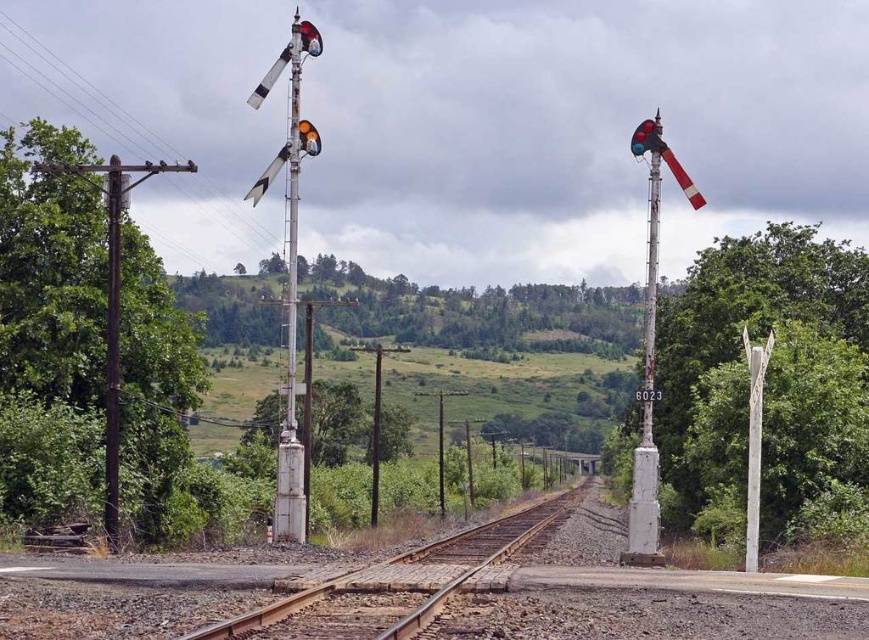
Question: Which object appears farthest from the camera in this image?

Choices:
 (A) metallic orange traffic light at center
 (B) white concrete pole at center

Answer: (A)

Question: Among these points, which one is farthest from the camera?

Choices:
 (A) (308, 124)
 (B) (463, 541)

Answer: (B)

Question: Can you confirm if brown gravel train track at center is positioned to the left of white painted metal pole at left?

Choices:
 (A) no
 (B) yes

Answer: (A)

Question: Is brown gravel train track at center wider than metallic signal light at upper left?

Choices:
 (A) yes
 (B) no

Answer: (A)

Question: Which object is the closest to the metallic orange traffic light at center?

Choices:
 (A) white painted metal pole at left
 (B) white concrete pole at center

Answer: (A)

Question: Can you confirm if white concrete pole at center is positioned to the left of metallic orange traffic light at center?

Choices:
 (A) no
 (B) yes

Answer: (A)